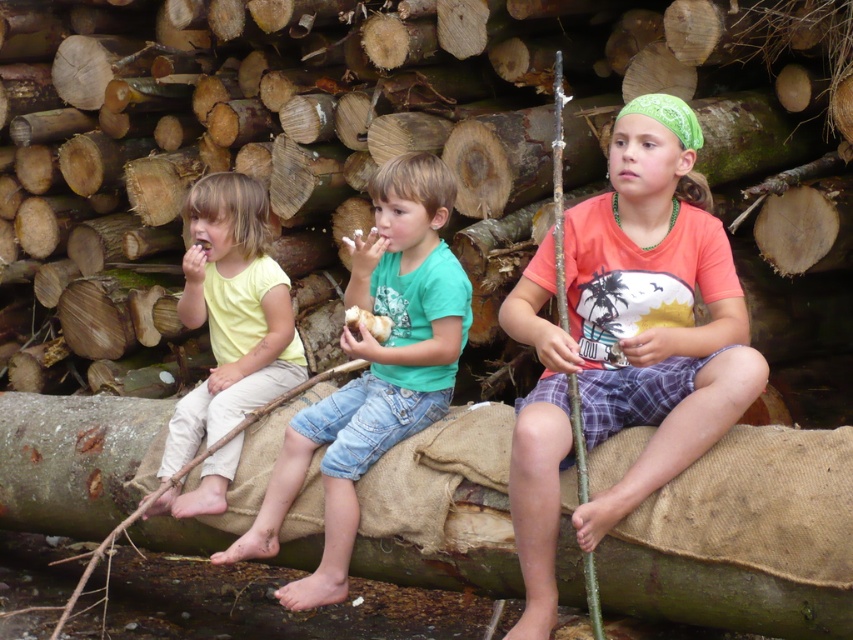
You are standing at the entrance of the log pile and want to find the brown rough log at center. According to the coordinates provided, in which direction should you move to locate it?

The brown rough log at center is located at coordinates point (743, 538), so you should move towards the right and slightly upwards to find it.

You are standing in front of the log where the children are sitting. There are two points marked on the log. One is at coordinate point [241,506] and the other is at point [448,176]. Which point is closer to you?

The point at coordinate [241,506] is closer to you because it is further to the camera than point [448,176].